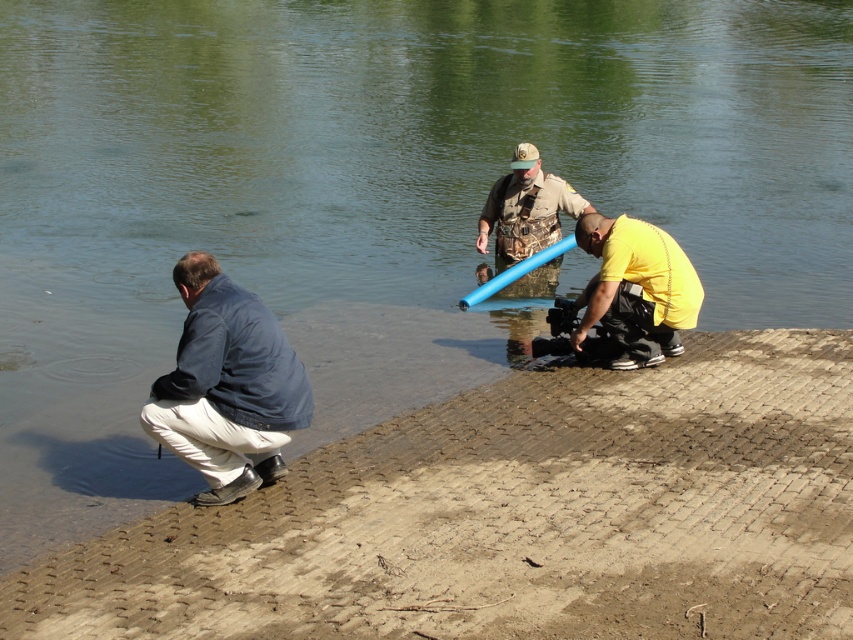
Is brown textured shore at lower left wider than camouflage shirt at center?

Correct, the width of brown textured shore at lower left exceeds that of camouflage shirt at center.

Between point (410, 576) and point (527, 248), which one is positioned in front?

Point (410, 576) is in front.

What do you see at coordinates (515, 516) in the screenshot?
I see `brown textured shore at lower left` at bounding box center [515, 516].

Find the location of `brown textured shore at lower left`. brown textured shore at lower left is located at coordinates (515, 516).

Which of these two, brown textured shore at lower left or yellow matte shirt at lower center, stands shorter?

With less height is yellow matte shirt at lower center.

Which is more to the left, brown textured shore at lower left or yellow matte shirt at lower center?

Positioned to the left is brown textured shore at lower left.

Is point (425, 504) farther from viewer compared to point (648, 349)?

No, (425, 504) is in front of (648, 349).

This screenshot has height=640, width=853. Identify the location of brown textured shore at lower left. (515, 516).

Is point (181, 266) closer to camera compared to point (558, 220)?

Yes.

Can you confirm if blue fabric jacket at lower left is positioned above camouflage shirt at center?

Incorrect, blue fabric jacket at lower left is not positioned above camouflage shirt at center.

Which is in front, point (202, 321) or point (512, 186)?

Point (202, 321) is in front.

Find the location of a particular element. The image size is (853, 640). blue fabric jacket at lower left is located at coordinates (227, 385).